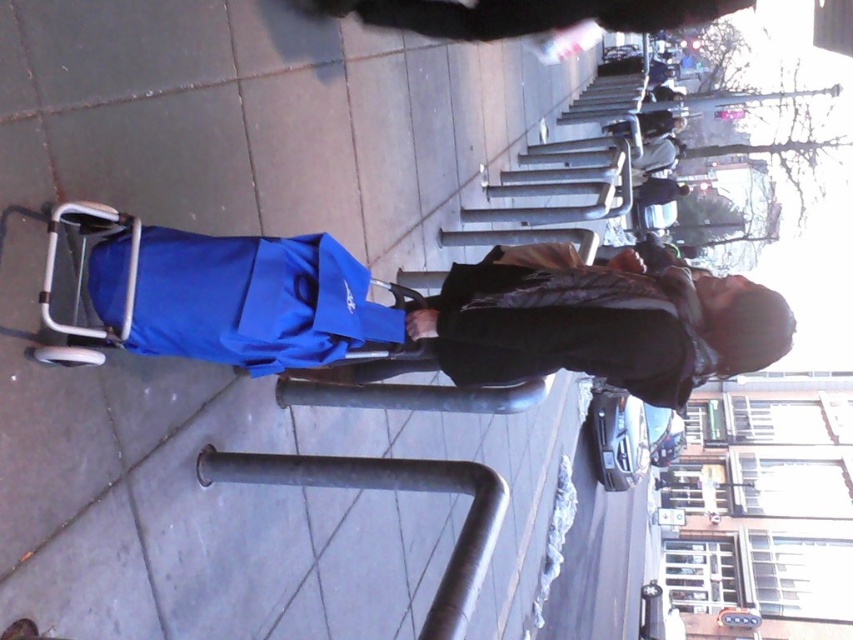
From the picture: Can you confirm if blue fabric bag at center is shorter than dark gray metal rail at center?

In fact, blue fabric bag at center may be taller than dark gray metal rail at center.

Which is behind, point (569, 250) or point (410, 484)?

The point (569, 250) is behind.

Between point (640, 397) and point (434, 476), which one is positioned in front?

Positioned in front is point (434, 476).

Find the location of `blue fabric bag at center`. blue fabric bag at center is located at coordinates (456, 314).

Can you confirm if blue fabric jacket at center is bigger than dark gray metal rail at center?

No, blue fabric jacket at center is not bigger than dark gray metal rail at center.

Who is more distant from viewer, (161,236) or (479,547)?

The point (161,236) is behind.

Locate an element on the screen. This screenshot has width=853, height=640. blue fabric jacket at center is located at coordinates (254, 300).

Measure the distance between blue fabric bag at center and camera.

A distance of 6.26 feet exists between blue fabric bag at center and camera.

Is point (705, 349) behind point (157, 312)?

Yes, it is behind point (157, 312).

At what (x,y) coordinates should I click in order to perform the action: click on blue fabric bag at center. Please return your answer as a coordinate pair (x, y). Looking at the image, I should click on (456, 314).